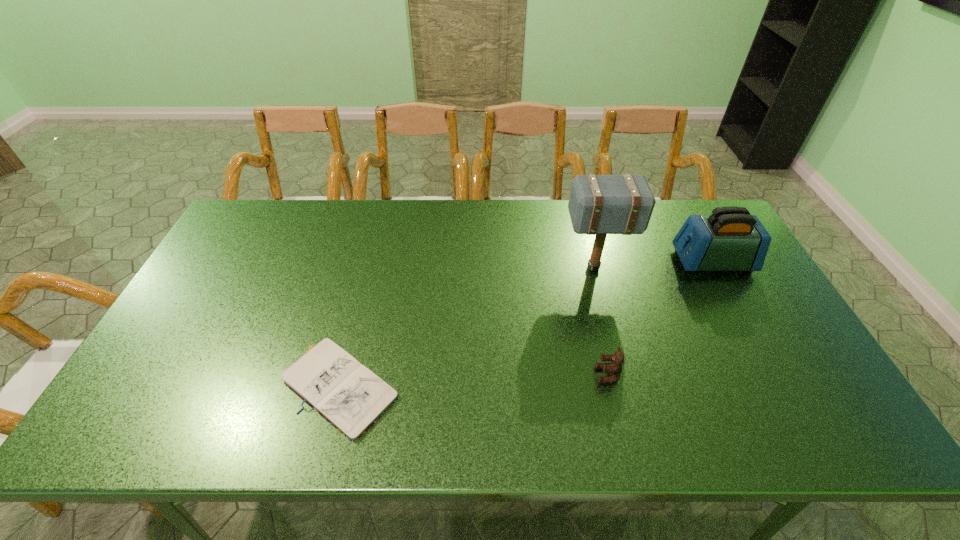
I want to click on free space located 0.370m on the front-facing side of the second tallest object, so click(557, 261).

Locate an element on the screen. vacant point located 0.170m on the front-facing side of the second tallest object is located at coordinates (620, 261).

Identify the location of vacant space located 0.290m on the face of the third tallest object. (478, 375).

At what (x,y) coordinates should I click in order to perform the action: click on vacant area situated 0.280m on the face of the third tallest object. Please return your answer as a coordinate pair (x, y). Looking at the image, I should click on (x=483, y=375).

This screenshot has height=540, width=960. In order to click on vacant space situated on the face of the third tallest object in this screenshot , I will do `click(547, 375)`.

Where is `vacant region located 0.200m on the back of the shortest object`? This screenshot has width=960, height=540. vacant region located 0.200m on the back of the shortest object is located at coordinates [367, 285].

Find the location of a particular element. object present at the near edge is located at coordinates (347, 394).

Image resolution: width=960 pixels, height=540 pixels. I want to click on object at the right edge, so click(730, 239).

The width and height of the screenshot is (960, 540). What are the coordinates of `free space at the far edge of the desktop` in the screenshot? It's located at 307,211.

Identify the location of vacant space at the near edge. Image resolution: width=960 pixels, height=540 pixels. (324, 426).